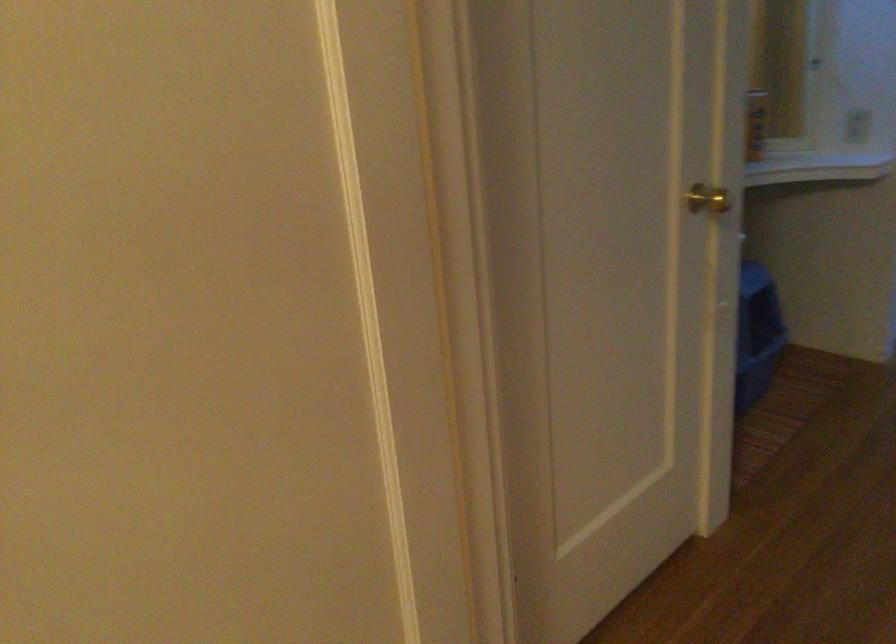
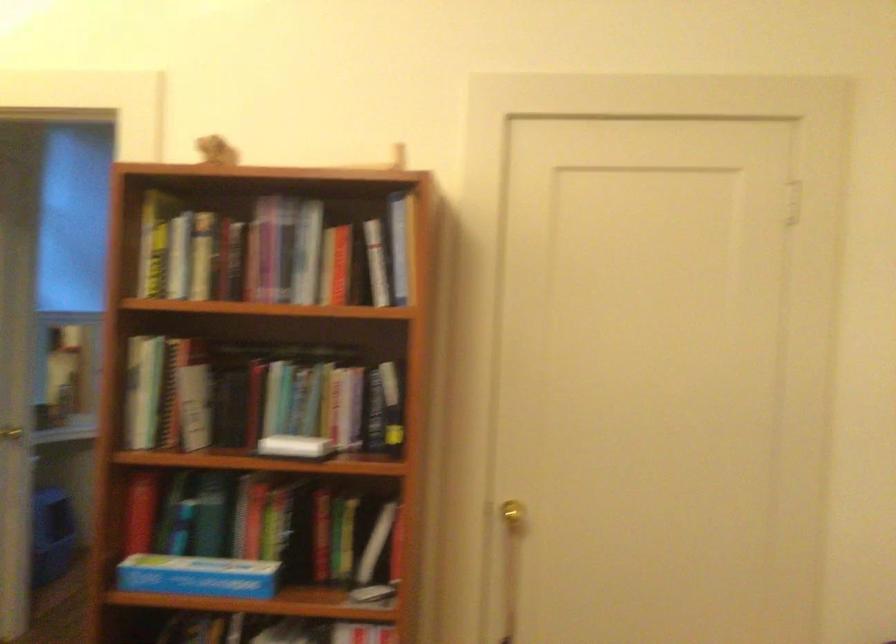
Find the pixel in the second image that matches [734,216] in the first image.

(11, 433)